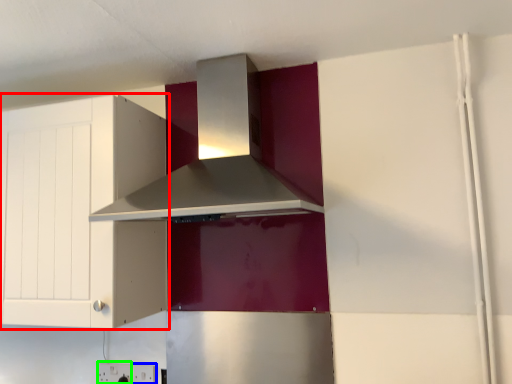
Question: Estimate the real-world distances between objects in this image. Which object is farther from cabinetry (highlighted by a red box), electric outlet (highlighted by a blue box) or electric outlet (highlighted by a green box)?

Choices:
 (A) electric outlet
 (B) electric outlet

Answer: (A)